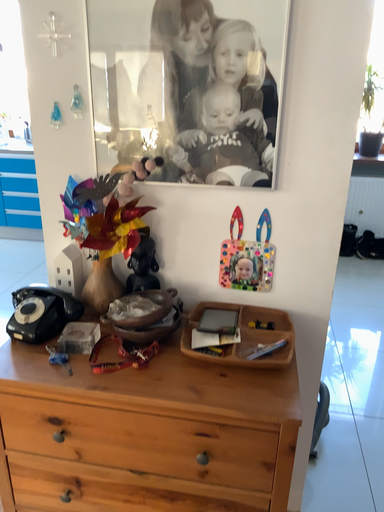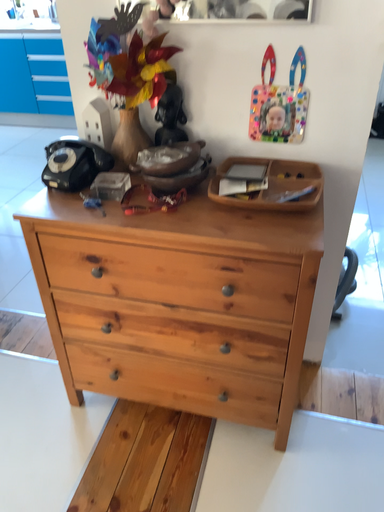
Question: How did the camera likely rotate when shooting the video?

Choices:
 (A) rotated upward
 (B) rotated downward

Answer: (B)